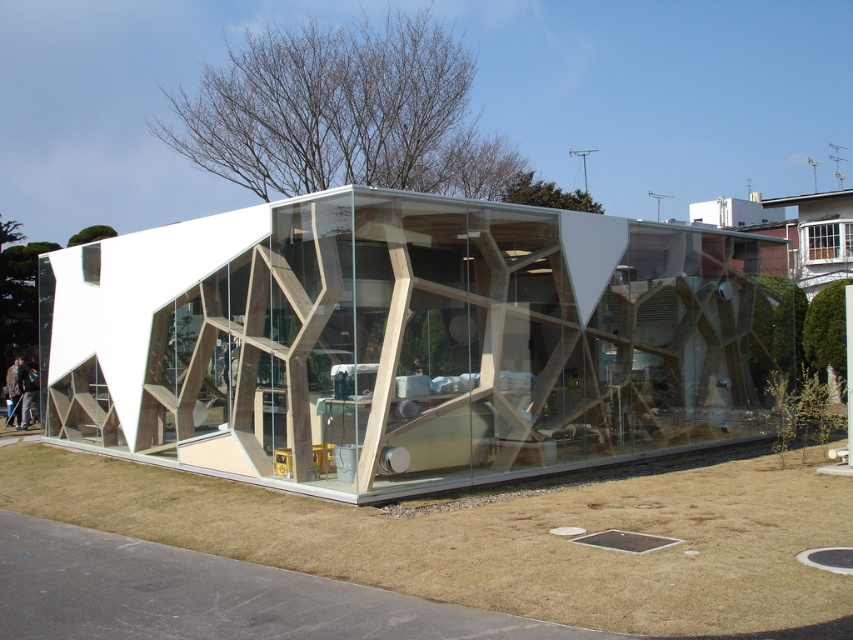
Question: Is transparent wood glass box at center bigger than brown dry grass at lower center?

Choices:
 (A) yes
 (B) no

Answer: (A)

Question: Is transparent wood glass box at center above brown dry grass at lower center?

Choices:
 (A) no
 (B) yes

Answer: (B)

Question: Is transparent wood glass box at center positioned before brown dry grass at lower center?

Choices:
 (A) yes
 (B) no

Answer: (B)

Question: Which object appears farthest from the camera in this image?

Choices:
 (A) transparent wood glass box at center
 (B) brown dry grass at lower center

Answer: (A)

Question: Among these points, which one is nearest to the camera?

Choices:
 (A) (772, 349)
 (B) (509, 518)

Answer: (B)